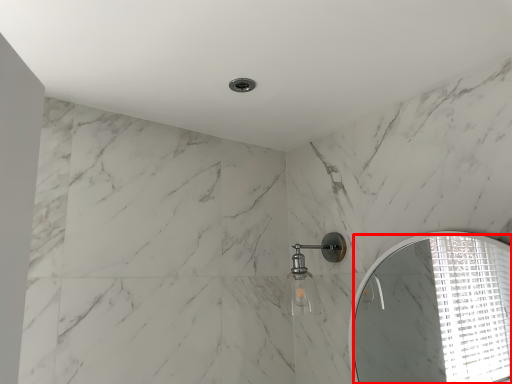
Question: From the image's perspective, where is mirror (annotated by the red box) located relative to shower?

Choices:
 (A) below
 (B) above

Answer: (A)